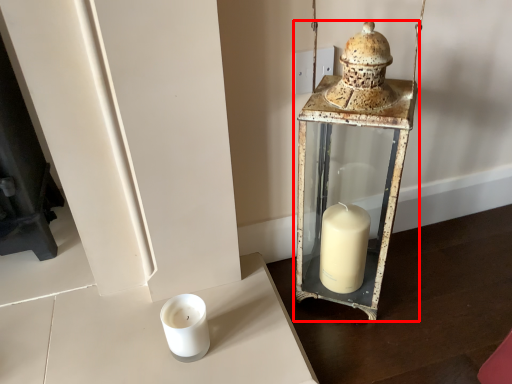
Question: In this image, where is lantern (annotated by the red box) located relative to candle holder?

Choices:
 (A) right
 (B) left

Answer: (A)